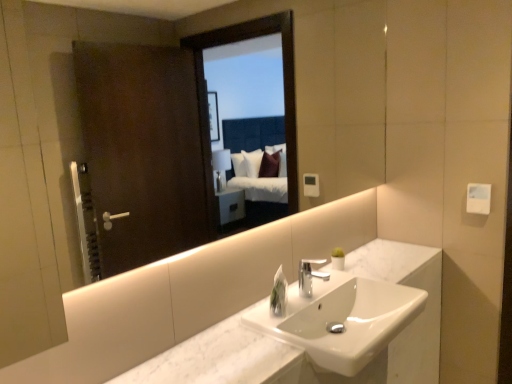
You are a GUI agent. You are given a task and a screenshot of the screen. Output one action in this format:
    pyautogui.click(x=<x>, y=<y>)
    Task: Click on the free space above white marble counter at center (from a real-world perspective)
    The width and height of the screenshot is (512, 384).
    Given the screenshot: What is the action you would take?
    pyautogui.click(x=303, y=300)